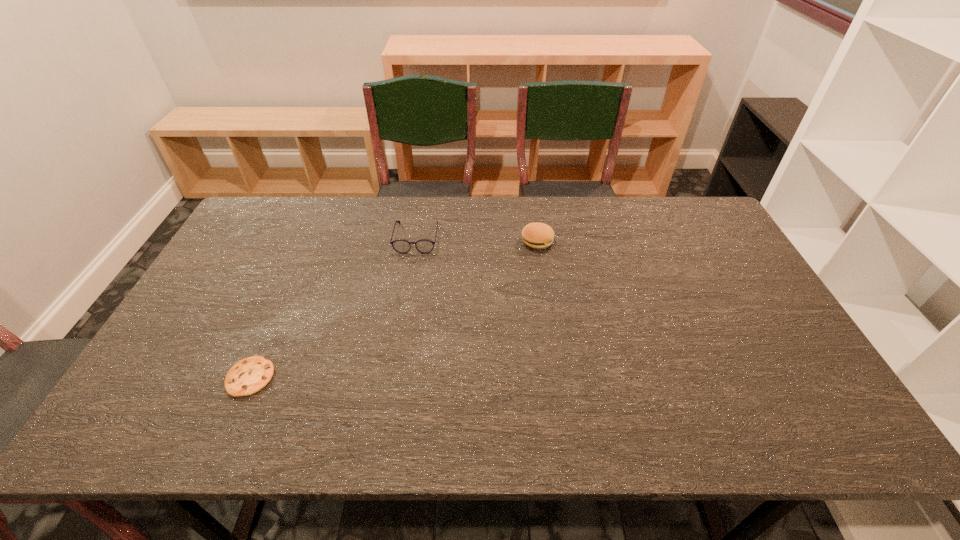
At what (x,y) coordinates should I click in order to perform the action: click on vacant space at the near edge of the desktop. Please return your answer as a coordinate pair (x, y). The image size is (960, 540). Looking at the image, I should click on (423, 432).

Where is `vacant space at the left edge of the desktop`? vacant space at the left edge of the desktop is located at coordinates (215, 360).

In the image, there is a desktop. Identify the location of vacant space at the right edge. This screenshot has height=540, width=960. coord(725,330).

Identify the location of vacant area at the near left corner. (156, 430).

The width and height of the screenshot is (960, 540). What are the coordinates of `free space at the far right corner of the desktop` in the screenshot? It's located at (669, 201).

Where is `empty space that is in between the patty and the second object from right to left`? empty space that is in between the patty and the second object from right to left is located at coordinates (477, 239).

You are a GUI agent. You are given a task and a screenshot of the screen. Output one action in this format:
    pyautogui.click(x=<x>, y=<y>)
    Task: Click on the vacant space in between the leftmost object and the spectacles
    
    Given the screenshot: What is the action you would take?
    pyautogui.click(x=333, y=307)

Where is `free space between the second object from right to left and the rightmost object`? free space between the second object from right to left and the rightmost object is located at coordinates (477, 239).

The width and height of the screenshot is (960, 540). I want to click on vacant area that lies between the leftmost object and the patty, so click(394, 309).

Where is `vacant area that lies between the rightmost object and the nearest object`? This screenshot has height=540, width=960. vacant area that lies between the rightmost object and the nearest object is located at coordinates (394, 309).